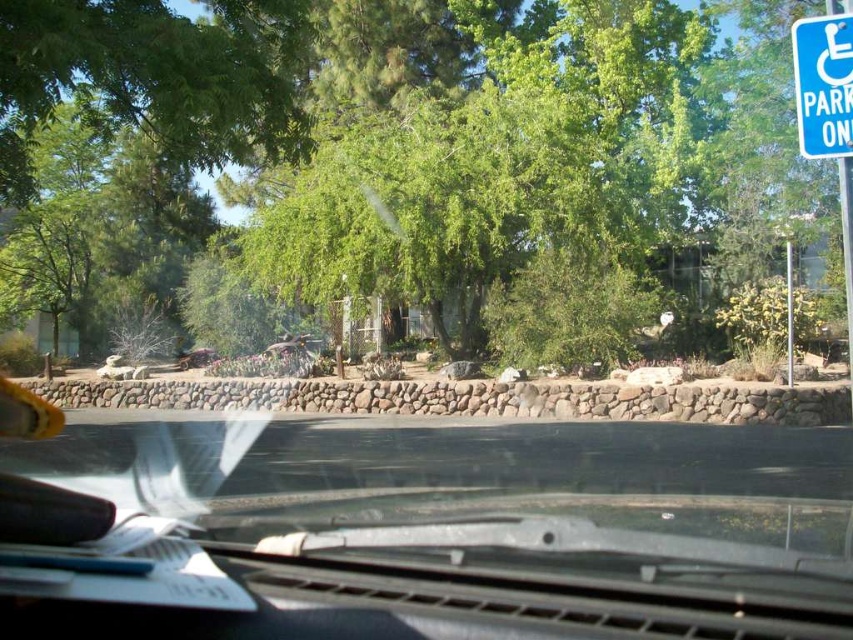
You are a driver checking the road ahead. You notice the transparent glass windshield at center and the blue plastic parking sign at upper right. Which object would block your view of the road more if they were both in your line of sight?

The transparent glass windshield at center would block your view of the road more because it is wider than the blue plastic parking sign at upper right.

You are a passenger in the car and notice the green leafy tree at center and the blue plastic parking sign at upper right outside the windshield. Which object is closer to you?

The green leafy tree at center is closer to you because the blue plastic parking sign at upper right is behind it.

You are sitting in the driver seat of the vehicle and looking out through the windshield. You see two points marked on the windshield at coordinates point (779, 152) and point (468, 596). Which point is closer to you?

Point (779, 152) is closer to you because it is further to the viewer than point (468, 596).